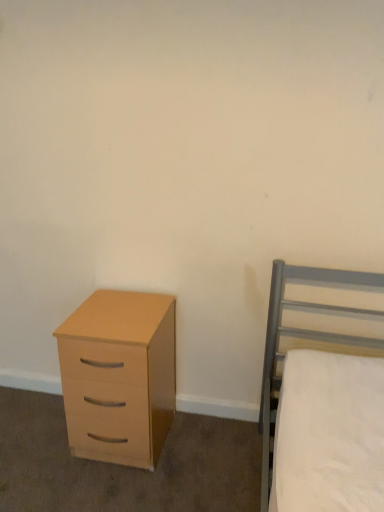
You are a GUI agent. You are given a task and a screenshot of the screen. Output one action in this format:
    pyautogui.click(x=<x>, y=<y>)
    Task: Click on the vacant area located to the right-hand side of light wood/veneer chest of drawers at lower left
    Image resolution: width=384 pixels, height=512 pixels.
    Given the screenshot: What is the action you would take?
    pyautogui.click(x=203, y=449)